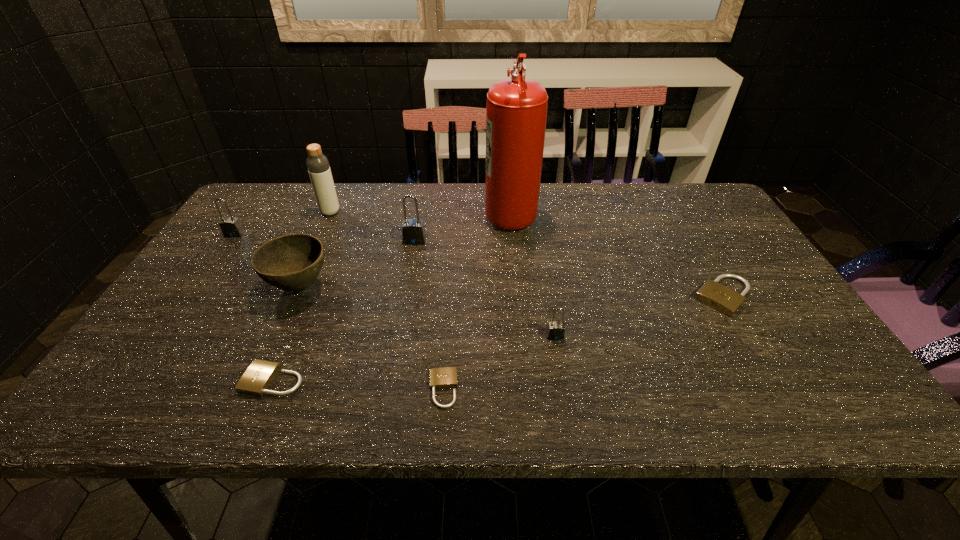
Locate an element on the screen. This screenshot has width=960, height=540. vacant area that lies between the tallest object and the rightmost gray padlock is located at coordinates (533, 274).

The height and width of the screenshot is (540, 960). I want to click on blank region between the gray bottle and the fourth shortest padlock, so click(443, 274).

Image resolution: width=960 pixels, height=540 pixels. Identify the location of vacant area that lies between the second biggest beige padlock and the red fire extinguisher. (392, 296).

Find the location of `empty space between the third nearest padlock and the leftmost object`. empty space between the third nearest padlock and the leftmost object is located at coordinates (395, 285).

Where is `free space between the brown bowl and the fifth padlock from left to right`? The width and height of the screenshot is (960, 540). free space between the brown bowl and the fifth padlock from left to right is located at coordinates click(427, 312).

Where is `free spot between the rightmost gray padlock and the tallest object`? This screenshot has height=540, width=960. free spot between the rightmost gray padlock and the tallest object is located at coordinates (533, 274).

Where is `free space between the shortest padlock and the second smallest gray padlock`? The width and height of the screenshot is (960, 540). free space between the shortest padlock and the second smallest gray padlock is located at coordinates (339, 312).

Find the location of a particular element. vacant region between the second tallest padlock and the fourth padlock from right to left is located at coordinates (324, 237).

Locate an element on the screen. object that is the fifth closest to the bottle is located at coordinates (257, 378).

Choose which object is the eighth nearest neighbor to the third shortest padlock. Please provide its 2D coordinates. Your answer should be formatted as a tuple, i.e. [(x, y)], where the tuple contains the x and y coordinates of a point satisfying the conditions above.

[(230, 226)]